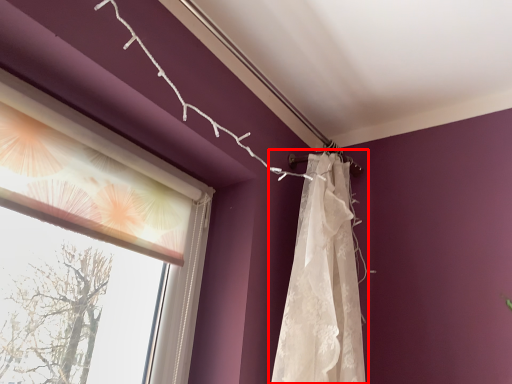
Question: From the image's perspective, where is curtain (annotated by the red box) located relative to window?

Choices:
 (A) above
 (B) below

Answer: (B)